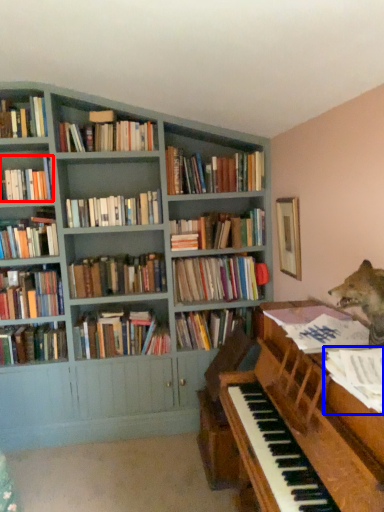
Question: Which of the following is the farthest to the observer, book (highlighted by a red box) or book (highlighted by a blue box)?

Choices:
 (A) book
 (B) book

Answer: (A)